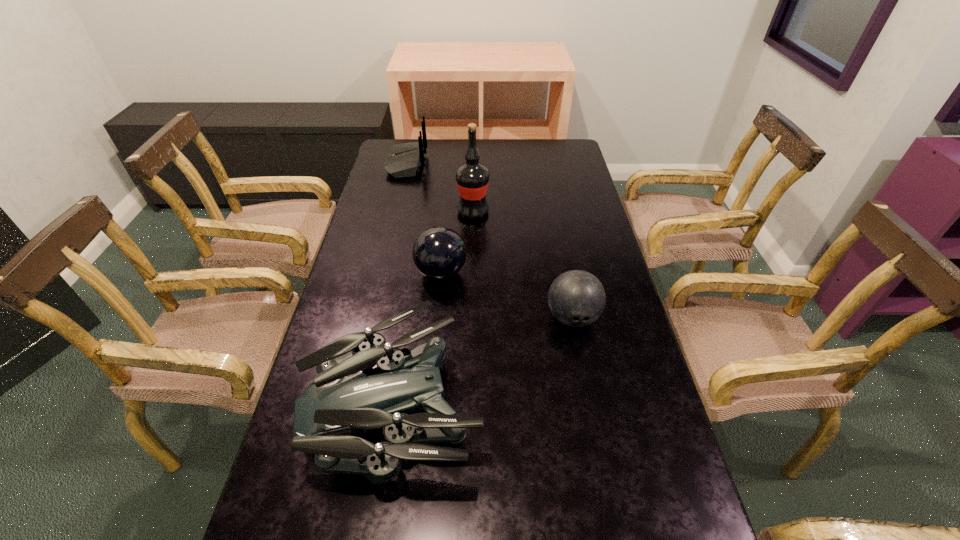
Image resolution: width=960 pixels, height=540 pixels. I want to click on vacant area at the right edge, so click(571, 171).

The height and width of the screenshot is (540, 960). I want to click on free spot between the second farthest object and the right bowling ball, so click(523, 265).

Locate an element on the screen. free space that is in between the router and the wine bottle is located at coordinates (440, 188).

Locate an element on the screen. Image resolution: width=960 pixels, height=540 pixels. object that is the fourth closest one to the tallest object is located at coordinates (342, 403).

Where is `object that is the third closest to the drone`? Image resolution: width=960 pixels, height=540 pixels. object that is the third closest to the drone is located at coordinates (472, 178).

Find the location of a particular element. the closest bowling ball to the tallest object is located at coordinates (439, 253).

Identify which bowling ball is the second nearest to the drone. Please provide its 2D coordinates. Your answer should be formatted as a tuple, i.e. [(x, y)], where the tuple contains the x and y coordinates of a point satisfying the conditions above.

[(576, 298)]

Find the location of a particular element. The height and width of the screenshot is (540, 960). vacant area that satisfies the following two spatial constraints: 1. on the back side of the drone; 2. on the back of the router is located at coordinates (432, 164).

Locate an element on the screen. free space in the image that satisfies the following two spatial constraints: 1. on the back of the wine bottle; 2. on the left side of the farthest object is located at coordinates (x=395, y=212).

Locate an element on the screen. free space in the image that satisfies the following two spatial constraints: 1. on the back of the router; 2. on the left side of the drone is located at coordinates (350, 402).